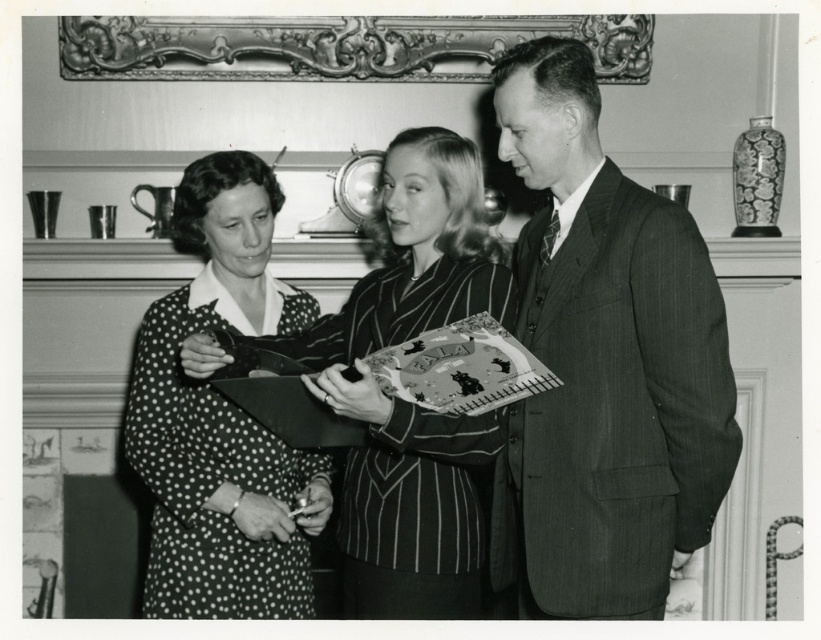
Consider the image. Does textured pinstripe suit at right appear under polka dot fabric dress at left?

No.

This screenshot has height=640, width=821. Describe the element at coordinates (604, 364) in the screenshot. I see `textured pinstripe suit at right` at that location.

Where is `textured pinstripe suit at right`? The width and height of the screenshot is (821, 640). textured pinstripe suit at right is located at coordinates (604, 364).

Is textured pinstripe suit at right to the right of gold ornate picture frame at upper center from the viewer's perspective?

Yes, textured pinstripe suit at right is to the right of gold ornate picture frame at upper center.

Between textured pinstripe suit at right and gold ornate picture frame at upper center, which one is positioned higher?

gold ornate picture frame at upper center is above.

This screenshot has width=821, height=640. Describe the element at coordinates (604, 364) in the screenshot. I see `textured pinstripe suit at right` at that location.

Locate an element on the screen. The width and height of the screenshot is (821, 640). textured pinstripe suit at right is located at coordinates (604, 364).

Can you confirm if polka dot fabric dress at center is shorter than gold ornate picture frame at upper center?

No, polka dot fabric dress at center is not shorter than gold ornate picture frame at upper center.

Who is lower down, polka dot fabric dress at center or gold ornate picture frame at upper center?

polka dot fabric dress at center is lower down.

Looking at this image, measure the distance between polka dot fabric dress at center and camera.

polka dot fabric dress at center and camera are 7.20 feet apart.

Image resolution: width=821 pixels, height=640 pixels. What are the coordinates of `polka dot fabric dress at center` in the screenshot? It's located at coord(402,401).